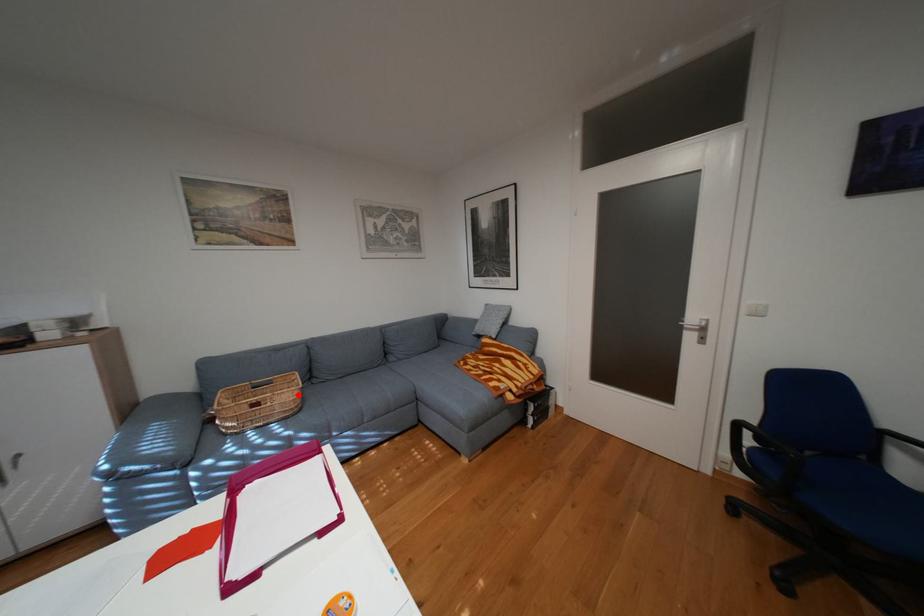
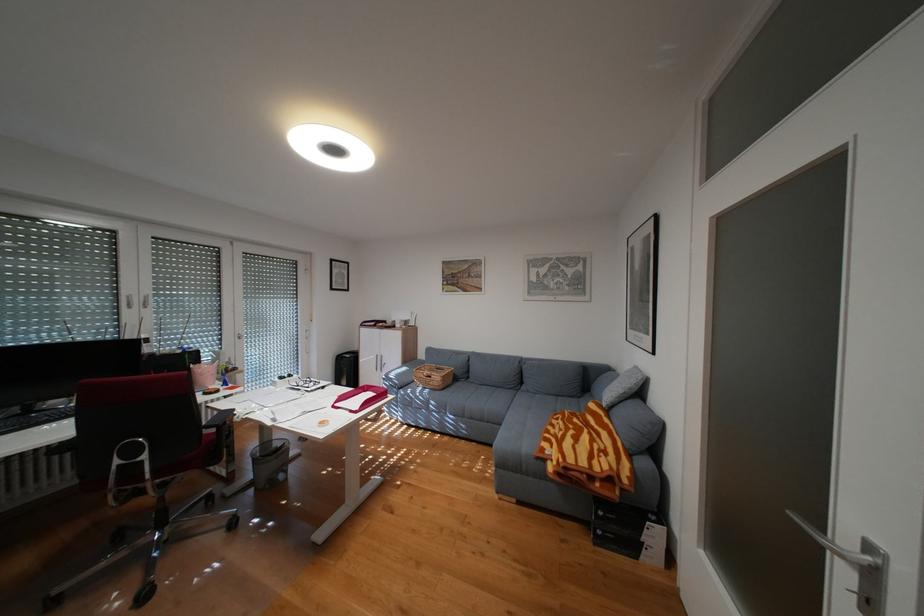
Question: I am providing you with two images of the same scene from different viewpoints. A red point is shown in image1. For the corresponding object point in image2, is it positioned nearer or farther from the camera?

Choices:
 (A) Nearer
 (B) Farther

Answer: (B)